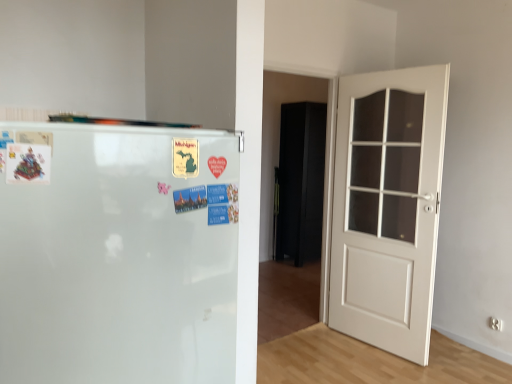
Locate an element on the screen. vacant space underneath white wooden door at right (from a real-world perspective) is located at coordinates (384, 354).